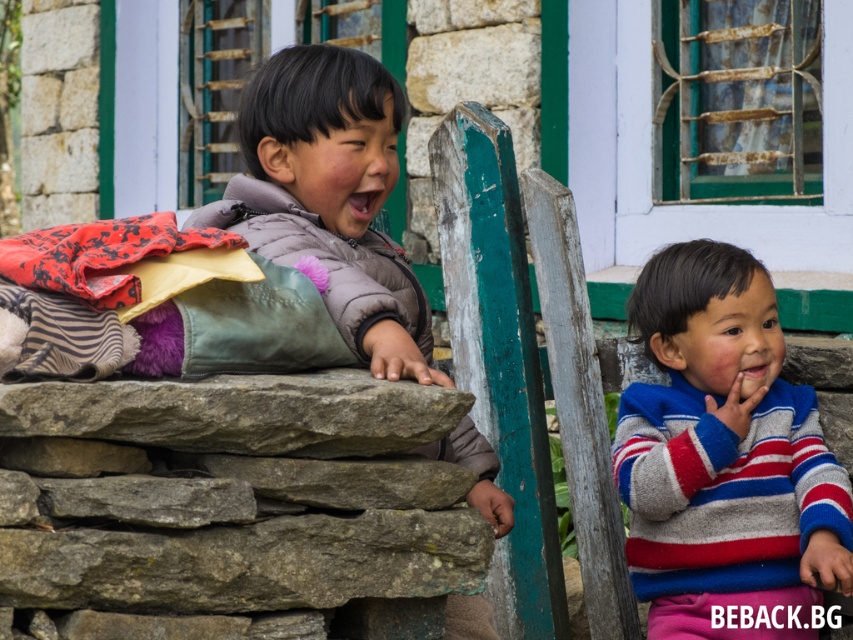
Question: Is striped wool sweater at right wider than matte gray jacket at center?

Choices:
 (A) yes
 (B) no

Answer: (B)

Question: Can you confirm if striped wool sweater at right is positioned above matte gray jacket at center?

Choices:
 (A) no
 (B) yes

Answer: (A)

Question: Which point appears farthest from the camera in this image?

Choices:
 (A) (683, 612)
 (B) (276, 170)

Answer: (B)

Question: Is striped wool sweater at right smaller than matte gray jacket at center?

Choices:
 (A) yes
 (B) no

Answer: (A)